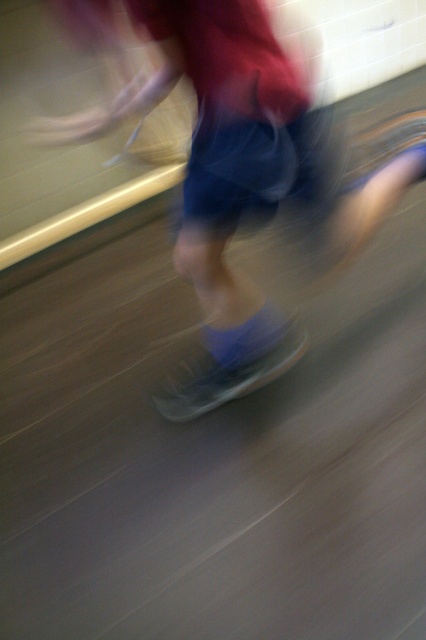
Question: In this image, where is matte gray skateboard at center located relative to translucent plastic skateboard at center?

Choices:
 (A) left
 (B) right

Answer: (B)

Question: Which point is closer to the camera?

Choices:
 (A) translucent plastic skateboard at center
 (B) matte gray skateboard at center

Answer: (B)

Question: Is matte gray skateboard at center above translucent plastic skateboard at center?

Choices:
 (A) yes
 (B) no

Answer: (A)

Question: Which point appears farthest from the camera in this image?

Choices:
 (A) (262, 348)
 (B) (310, 148)

Answer: (A)

Question: Which point is closer to the camera?

Choices:
 (A) matte gray skateboard at center
 (B) translucent plastic skateboard at center

Answer: (A)

Question: Does matte gray skateboard at center appear on the right side of translucent plastic skateboard at center?

Choices:
 (A) no
 (B) yes

Answer: (B)